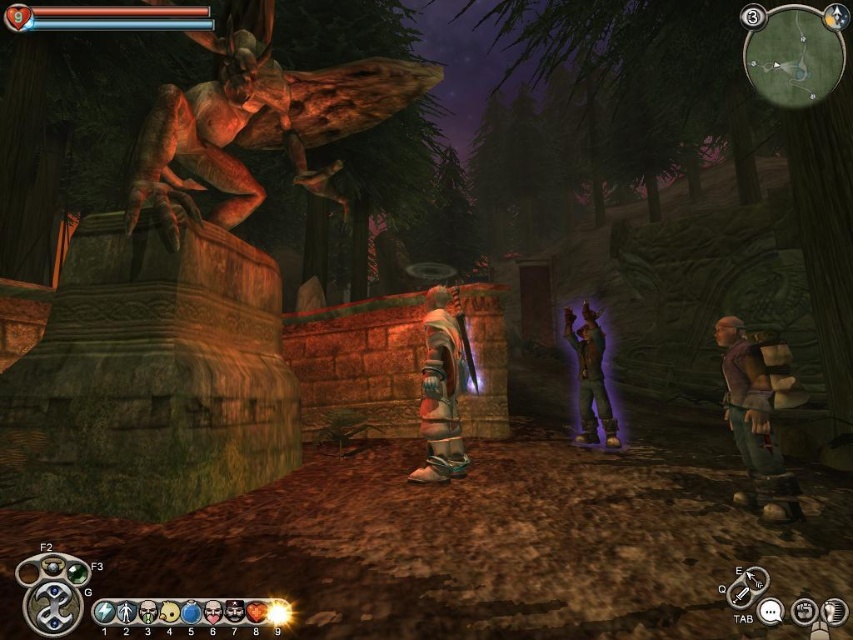
You are a character in the game who needs to decide which item to pick up first. The shiny silver armor at center and the leather jacket at center are both on the ground in front of you. Based on their sizes, which one might be easier to carry because it takes up less space?

The shiny silver armor at center has a lesser width compared to the leather jacket at center, so it might be easier to carry because it takes up less space.

You are a character in the game who needs to carry both the purple fabric backpack at lower right and the shiny silver armor at center. Since you can only carry one item at a time, which item should you pick up first if you want to move them both to a nearby storage chest located to the east?

You should pick up the purple fabric backpack at lower right first because it is wider than the shiny silver armor at center, making it harder to maneuver through the narrow forest path to the east.